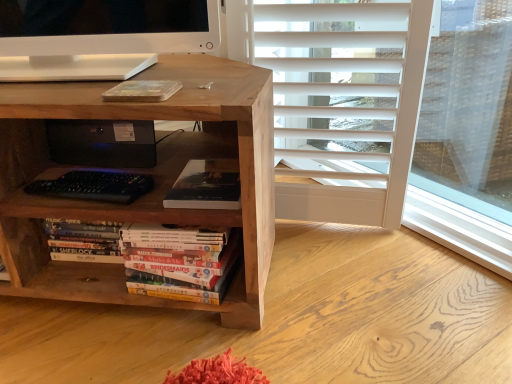
Question: Does matte black book at center, positioned as the second book in bottom-to-top order, have a greater width compared to hardcover books at center, the first book when ordered from bottom to top?

Choices:
 (A) yes
 (B) no

Answer: (A)

Question: Is matte black book at center, positioned as the first book in top-to-bottom order, not inside hardcover books at center, the first book when ordered from bottom to top?

Choices:
 (A) no
 (B) yes

Answer: (B)

Question: Is matte black book at center, positioned as the first book in top-to-bottom order, not close to hardcover books at center, the first book when ordered from bottom to top?

Choices:
 (A) no
 (B) yes

Answer: (A)

Question: Is matte black book at center, positioned as the second book in bottom-to-top order, beside hardcover books at center, which is the 2th book from top to bottom?

Choices:
 (A) yes
 (B) no

Answer: (B)

Question: From a real-world perspective, is matte black book at center, positioned as the first book in top-to-bottom order, on top of hardcover books at center, which is the 2th book from top to bottom?

Choices:
 (A) no
 (B) yes

Answer: (B)

Question: From a real-world perspective, does matte black book at center, positioned as the first book in top-to-bottom order, sit lower than hardcover books at center, the first book when ordered from bottom to top?

Choices:
 (A) yes
 (B) no

Answer: (B)

Question: From a real-world perspective, is hardcover books at center, the first book when ordered from bottom to top, on top of natural wood desk at center?

Choices:
 (A) yes
 (B) no

Answer: (B)

Question: From the image's perspective, is hardcover books at center, the first book when ordered from bottom to top, located above natural wood desk at center?

Choices:
 (A) yes
 (B) no

Answer: (B)

Question: Is hardcover books at center, which is the 2th book from top to bottom, taller than natural wood desk at center?

Choices:
 (A) no
 (B) yes

Answer: (A)

Question: Is hardcover books at center, which is the 2th book from top to bottom, not inside natural wood desk at center?

Choices:
 (A) yes
 (B) no

Answer: (B)

Question: Is hardcover books at center, which is the 2th book from top to bottom, far from natural wood desk at center?

Choices:
 (A) no
 (B) yes

Answer: (A)

Question: From the image's perspective, is hardcover books at center, which is the 2th book from top to bottom, located beneath natural wood desk at center?

Choices:
 (A) no
 (B) yes

Answer: (B)

Question: Does black plastic speaker at center have a smaller size compared to natural wood desk at center?

Choices:
 (A) yes
 (B) no

Answer: (A)